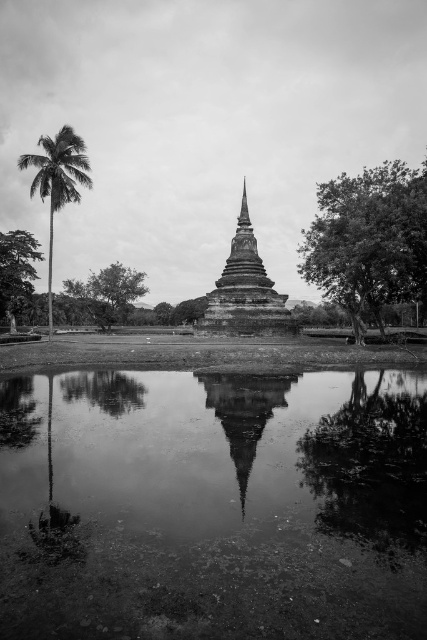
Question: Which is farther from the smooth green tree at left?

Choices:
 (A) smooth bark tree at right
 (B) smooth stone stupa at center
 (C) smooth glass water at center
 (D) green leafy tree at center

Answer: (A)

Question: From the image, what is the correct spatial relationship of transparent water at center in relation to smooth green tree at left?

Choices:
 (A) left
 (B) right

Answer: (B)

Question: Can you confirm if smooth bark tree at right is bigger than smooth brown palm tree at left?

Choices:
 (A) yes
 (B) no

Answer: (A)

Question: Which object is the farthest from the smooth bark tree at right?

Choices:
 (A) smooth brown palm tree at left
 (B) transparent water at center

Answer: (A)

Question: Can you confirm if smooth bark tree at right is positioned below smooth brown palm tree at left?

Choices:
 (A) no
 (B) yes

Answer: (A)

Question: Which is nearer to the smooth stone stupa at center?

Choices:
 (A) smooth green tree at left
 (B) green leafy tree at center

Answer: (B)